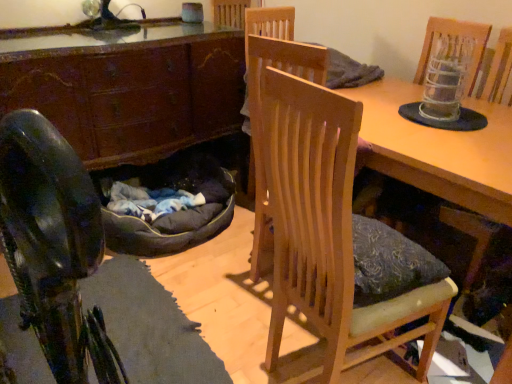
Question: Could wooden table at center be considered to be inside dark brown wood cabinet at left?

Choices:
 (A) yes
 (B) no

Answer: (B)

Question: Is dark brown wood cabinet at left at the left side of wooden table at center?

Choices:
 (A) yes
 (B) no

Answer: (A)

Question: Is dark brown wood cabinet at left touching wooden table at center?

Choices:
 (A) no
 (B) yes

Answer: (A)

Question: Is dark brown wood cabinet at left turned away from wooden table at center?

Choices:
 (A) yes
 (B) no

Answer: (B)

Question: From the image's perspective, is dark brown wood cabinet at left on wooden table at center?

Choices:
 (A) yes
 (B) no

Answer: (A)

Question: Is dark brown wood cabinet at left positioned before wooden table at center?

Choices:
 (A) yes
 (B) no

Answer: (B)

Question: Does wooden chair at center turn towards dark brown wood cabinet at left?

Choices:
 (A) yes
 (B) no

Answer: (B)

Question: Is wooden chair at center to the right of dark brown wood cabinet at left from the viewer's perspective?

Choices:
 (A) no
 (B) yes

Answer: (B)

Question: Could dark brown wood cabinet at left be considered to be inside wooden chair at center?

Choices:
 (A) yes
 (B) no

Answer: (B)

Question: Considering the relative sizes of wooden chair at center and dark brown wood cabinet at left in the image provided, is wooden chair at center thinner than dark brown wood cabinet at left?

Choices:
 (A) yes
 (B) no

Answer: (A)

Question: Can you confirm if wooden chair at center is wider than dark brown wood cabinet at left?

Choices:
 (A) yes
 (B) no

Answer: (B)

Question: From a real-world perspective, does wooden chair at center sit lower than dark brown wood cabinet at left?

Choices:
 (A) yes
 (B) no

Answer: (B)

Question: Does wooden chair at center have a lesser width compared to wooden table at center?

Choices:
 (A) no
 (B) yes

Answer: (B)